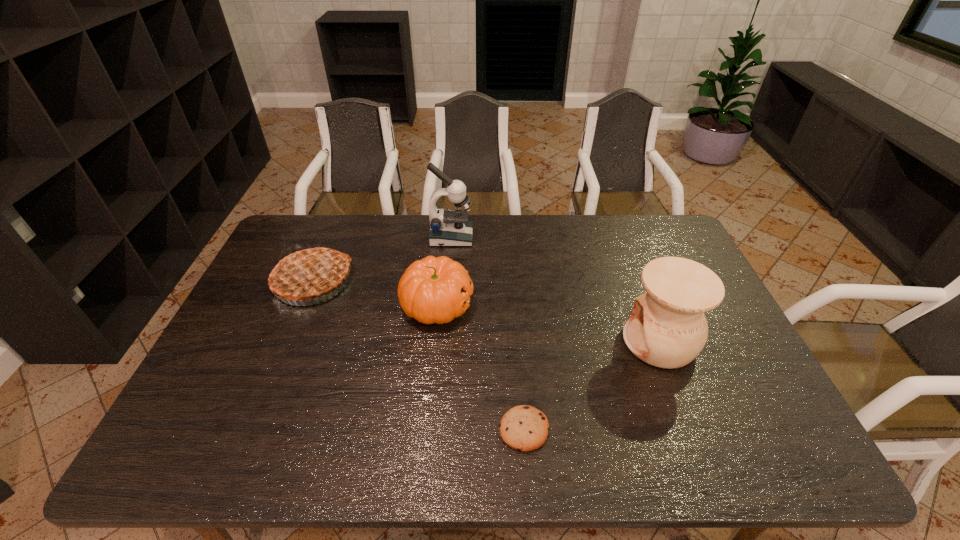
In order to click on vacant space located 0.100m at the open side of the rightmost object in this screenshot , I will do `click(587, 341)`.

The width and height of the screenshot is (960, 540). What are the coordinates of `free space located 0.310m at the open side of the rightmost object` in the screenshot? It's located at (511, 341).

Locate an element on the screen. This screenshot has width=960, height=540. blank area located at the open side of the rightmost object is located at coordinates (572, 341).

What are the coordinates of `vacant area situated on the right of the third shortest object` in the screenshot? It's located at (372, 281).

You are a GUI agent. You are given a task and a screenshot of the screen. Output one action in this format:
    pyautogui.click(x=<x>, y=<y>)
    Task: Click on the vacant space located on the carved face of the pumpkin
    This screenshot has height=540, width=960.
    Given the screenshot: What is the action you would take?
    pyautogui.click(x=500, y=305)

The width and height of the screenshot is (960, 540). I want to click on vacant region located on the right of the shortest object, so click(x=652, y=429).

Find the location of a particular element. object positioned at the far edge is located at coordinates (448, 227).

The height and width of the screenshot is (540, 960). I want to click on object that is at the near edge, so [x=523, y=427].

The width and height of the screenshot is (960, 540). In order to click on object situated at the left edge in this screenshot , I will do click(x=307, y=273).

The width and height of the screenshot is (960, 540). Find the location of `object situated at the right edge`. object situated at the right edge is located at coordinates (667, 328).